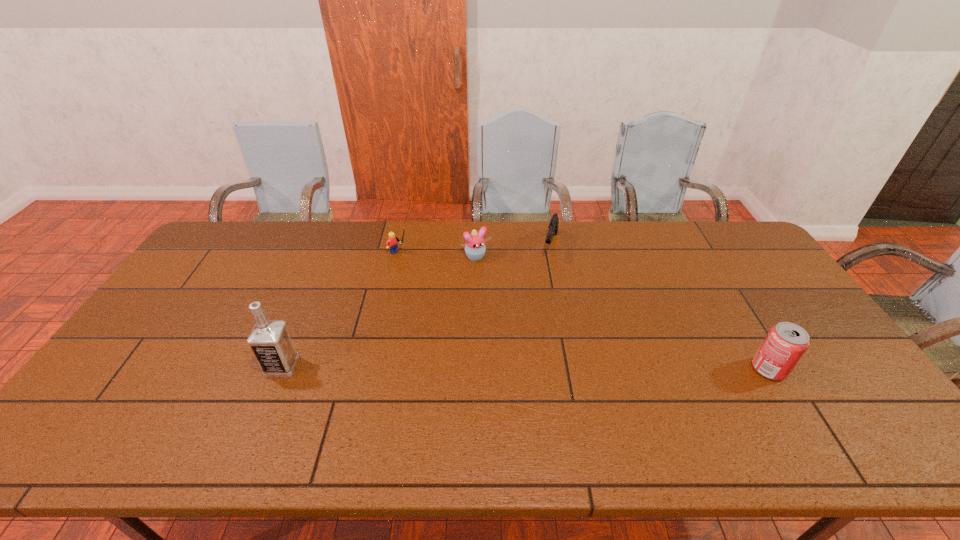
Identify the location of vacant space on the desktop that is between the leftmost object and the second tallest object and is positioned at the end of the barrel of the second object from right to left. (515, 367).

Find the location of a particular element. vacant space on the desktop that is between the leftmost object and the fourth shortest object and is positioned on the front-facing side of the Lego is located at coordinates (544, 368).

Image resolution: width=960 pixels, height=540 pixels. In order to click on free spot on the desktop that is between the leftmost object and the soda can and is positioned on the face of the third object from left to right in this screenshot , I will do `click(553, 368)`.